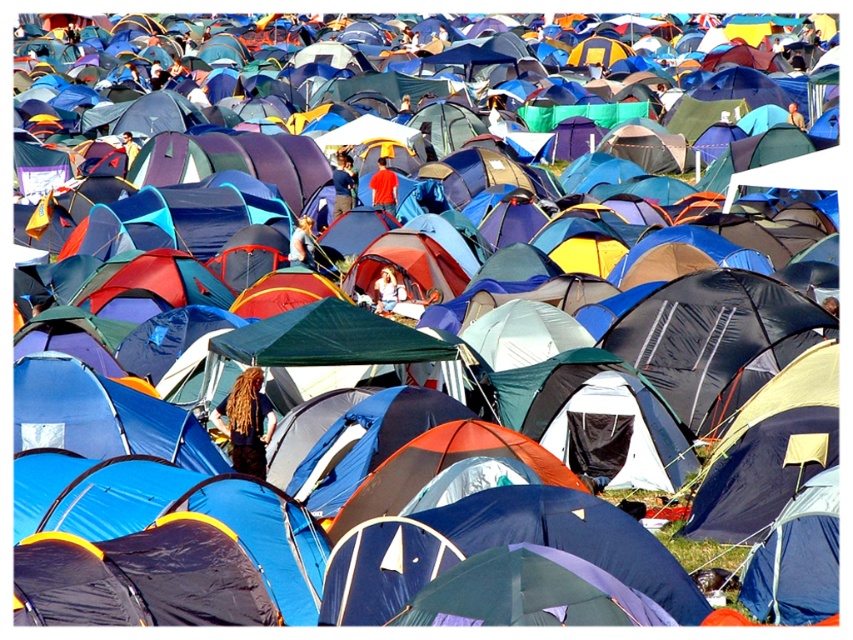
Question: Does dark blue fabric person at center appear on the left side of brown hair at center?

Choices:
 (A) yes
 (B) no

Answer: (B)

Question: Observing the image, what is the correct spatial positioning of light brown hair at center in reference to light blue fabric tent at center?

Choices:
 (A) above
 (B) below

Answer: (A)

Question: Which of the following is the closest to the observer?

Choices:
 (A) (390, 310)
 (B) (355, 177)
 (C) (299, 237)

Answer: (A)

Question: Can you confirm if brown hair at center is smaller than light brown hair at center?

Choices:
 (A) no
 (B) yes

Answer: (A)

Question: Which point is farther from the camera taking this photo?

Choices:
 (A) (239, 387)
 (B) (793, 108)

Answer: (B)

Question: Which of these objects is positioned farthest from the matte red shirt at center?

Choices:
 (A) light brown hair at center
 (B) dark brown hair at center
 (C) dark blue fabric person at center

Answer: (C)